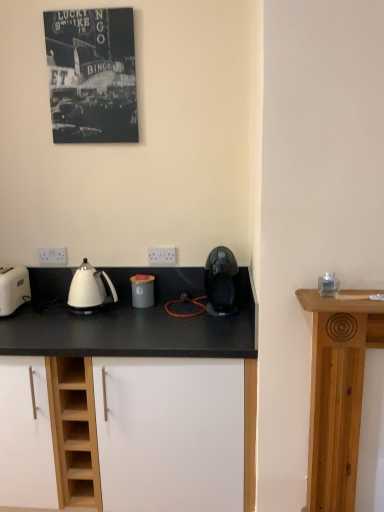
Question: From the image's perspective, is matte gray canister at center, which is the 2th kitchen appliance from right to left, under white glossy kettle at left?

Choices:
 (A) yes
 (B) no

Answer: (A)

Question: Does matte gray canister at center, the 1th kitchen appliance in the left-to-right sequence, have a lesser width compared to white glossy kettle at left?

Choices:
 (A) yes
 (B) no

Answer: (A)

Question: Can you confirm if matte gray canister at center, which is the 2th kitchen appliance from right to left, is taller than white glossy kettle at left?

Choices:
 (A) no
 (B) yes

Answer: (A)

Question: From a real-world perspective, is matte gray canister at center, which is the 2th kitchen appliance from right to left, physically below white glossy kettle at left?

Choices:
 (A) no
 (B) yes

Answer: (B)

Question: Does matte gray canister at center, which is the 2th kitchen appliance from right to left, have a lesser height compared to white glossy kettle at left?

Choices:
 (A) yes
 (B) no

Answer: (A)

Question: Is white matte cabinet at center spatially inside white plastic toaster at left, or outside of it?

Choices:
 (A) inside
 (B) outside

Answer: (B)

Question: Is white matte cabinet at center wider or thinner than white plastic toaster at left?

Choices:
 (A) wide
 (B) thin

Answer: (A)

Question: Considering the positions of white matte cabinet at center and white plastic toaster at left in the image, is white matte cabinet at center taller or shorter than white plastic toaster at left?

Choices:
 (A) tall
 (B) short

Answer: (A)

Question: Looking at the image, does white matte cabinet at center seem bigger or smaller compared to white plastic toaster at left?

Choices:
 (A) big
 (B) small

Answer: (A)

Question: Relative to clear glass candle at upper right, is white plastic electric outlet at center, the second electric outlet from the back, in front or behind?

Choices:
 (A) behind
 (B) front

Answer: (A)

Question: Is white plastic electric outlet at center, the 2th electric outlet when ordered from left to right, inside the boundaries of clear glass candle at upper right, or outside?

Choices:
 (A) outside
 (B) inside

Answer: (A)

Question: Considering the positions of white plastic electric outlet at center, arranged as the first electric outlet when viewed from the front, and clear glass candle at upper right in the image, is white plastic electric outlet at center, arranged as the first electric outlet when viewed from the front, taller or shorter than clear glass candle at upper right?

Choices:
 (A) tall
 (B) short

Answer: (A)

Question: From the image's perspective, is white plastic electric outlet at center, arranged as the first electric outlet when viewed from the front, positioned above or below clear glass candle at upper right?

Choices:
 (A) above
 (B) below

Answer: (A)

Question: Visually, is white plastic electric outlet at lower left, which is counted as the 1th electric outlet, starting from the back, positioned to the left or to the right of white plastic electric outlet at center, marked as the 1th electric outlet in a right-to-left arrangement?

Choices:
 (A) right
 (B) left

Answer: (B)

Question: From the image's perspective, relative to white plastic electric outlet at center, the second electric outlet from the back, is white plastic electric outlet at lower left, the second electric outlet positioned from the right, above or below?

Choices:
 (A) below
 (B) above

Answer: (A)